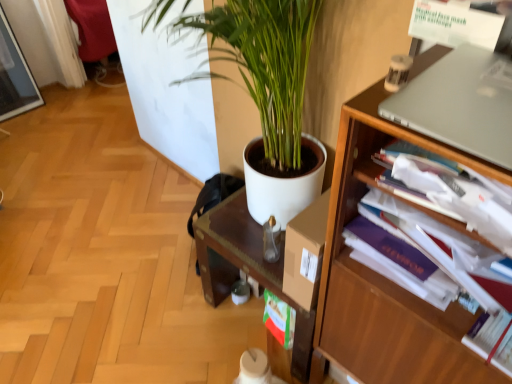
Question: Is the depth of silver metallic laptop at upper right less than that of purple paperback book at right?

Choices:
 (A) no
 (B) yes

Answer: (B)

Question: Can you confirm if silver metallic laptop at upper right is positioned to the left of purple paperback book at right?

Choices:
 (A) no
 (B) yes

Answer: (A)

Question: Can you confirm if silver metallic laptop at upper right is bigger than purple paperback book at right?

Choices:
 (A) yes
 (B) no

Answer: (B)

Question: From the image's perspective, is silver metallic laptop at upper right located beneath purple paperback book at right?

Choices:
 (A) no
 (B) yes

Answer: (A)

Question: Considering the relative positions of silver metallic laptop at upper right and purple paperback book at right in the image provided, is silver metallic laptop at upper right to the right of purple paperback book at right from the viewer's perspective?

Choices:
 (A) yes
 (B) no

Answer: (A)

Question: Can you confirm if silver metallic laptop at upper right is thinner than purple paperback book at right?

Choices:
 (A) yes
 (B) no

Answer: (B)

Question: Can you confirm if white matte plant pot at center is positioned to the left of silver metallic laptop at upper right?

Choices:
 (A) yes
 (B) no

Answer: (A)

Question: Can you confirm if white matte plant pot at center is bigger than silver metallic laptop at upper right?

Choices:
 (A) yes
 (B) no

Answer: (A)

Question: Considering the relative sizes of white matte plant pot at center and silver metallic laptop at upper right in the image provided, is white matte plant pot at center taller than silver metallic laptop at upper right?

Choices:
 (A) yes
 (B) no

Answer: (A)

Question: Is white matte plant pot at center smaller than silver metallic laptop at upper right?

Choices:
 (A) no
 (B) yes

Answer: (A)

Question: Considering the relative sizes of white matte plant pot at center and silver metallic laptop at upper right in the image provided, is white matte plant pot at center thinner than silver metallic laptop at upper right?

Choices:
 (A) yes
 (B) no

Answer: (B)

Question: Is white matte plant pot at center positioned with its back to silver metallic laptop at upper right?

Choices:
 (A) no
 (B) yes

Answer: (A)

Question: Is there a large distance between purple paperback book at right and wooden bookshelf at right?

Choices:
 (A) yes
 (B) no

Answer: (B)